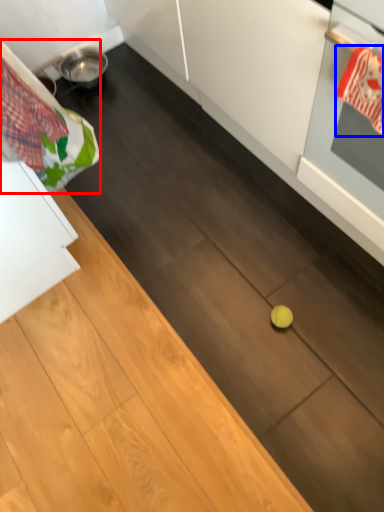
Question: Which object is further to the camera taking this photo, laundry (highlighted by a red box) or material (highlighted by a blue box)?

Choices:
 (A) laundry
 (B) material

Answer: (B)